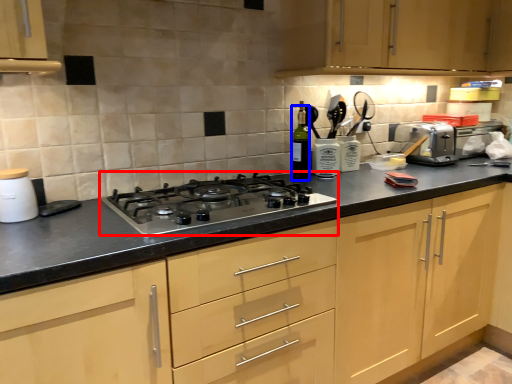
Question: Which point is closer to the camera, gas stove (highlighted by a red box) or bottle (highlighted by a blue box)?

Choices:
 (A) gas stove
 (B) bottle

Answer: (A)